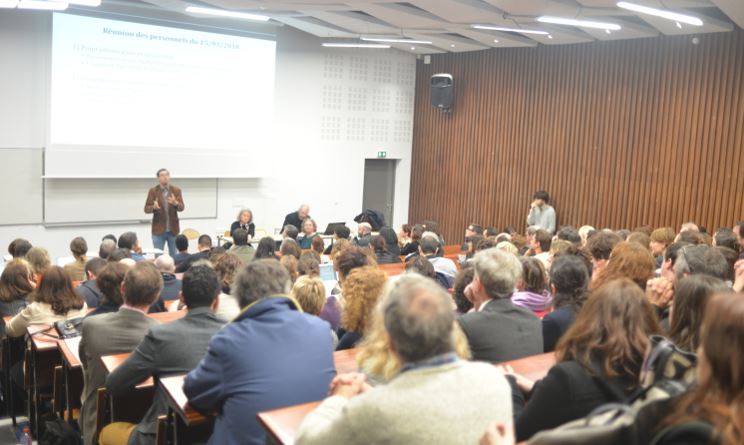
Locate an element on the screen. exit door in the background is located at coordinates (379, 179).